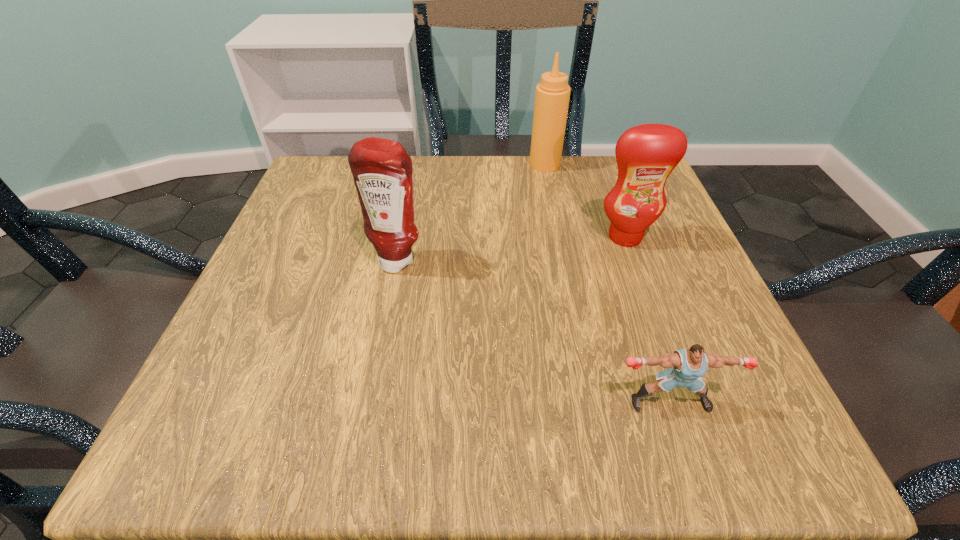
The width and height of the screenshot is (960, 540). Find the location of `the farthest condiment`. the farthest condiment is located at coordinates (552, 96).

Find the location of a particular element. The width and height of the screenshot is (960, 540). the second condiment from right to left is located at coordinates (552, 96).

Locate an element on the screen. the leftmost condiment is located at coordinates (382, 170).

The image size is (960, 540). Find the location of `the rightmost condiment`. the rightmost condiment is located at coordinates (646, 154).

Find the location of a particular element. This screenshot has height=540, width=960. the shortest object is located at coordinates (687, 366).

Find the location of `puncher`. puncher is located at coordinates (687, 366).

Identify the location of vacant space located 0.330m on the front of the farthest condiment. (566, 274).

Where is `free region located on the back of the leftmost condiment`? This screenshot has width=960, height=540. free region located on the back of the leftmost condiment is located at coordinates (416, 167).

Where is `free region located 0.330m on the label side of the rightmost condiment`? Image resolution: width=960 pixels, height=540 pixels. free region located 0.330m on the label side of the rightmost condiment is located at coordinates (688, 413).

Find the location of `vacant space located on the front-facing side of the shortest object`. vacant space located on the front-facing side of the shortest object is located at coordinates (685, 450).